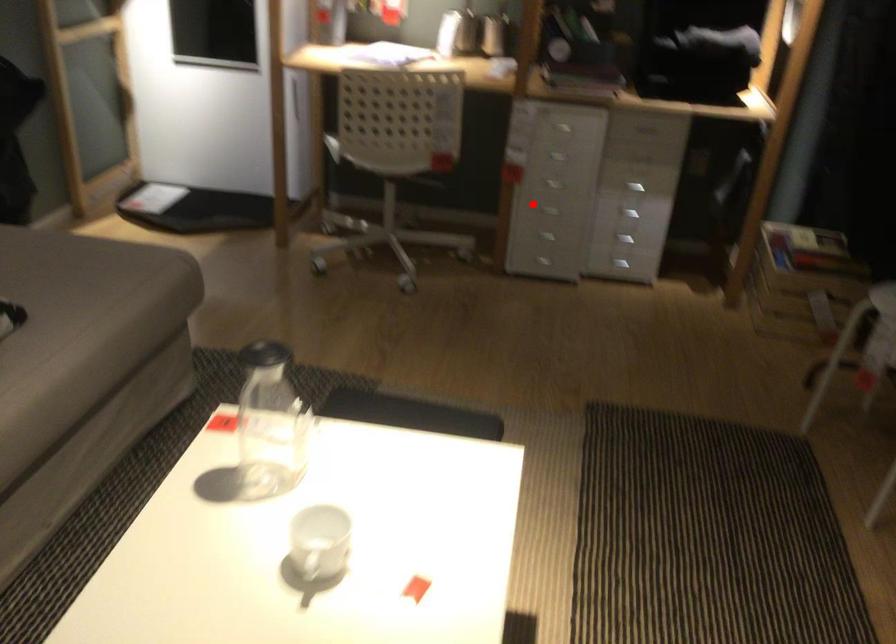
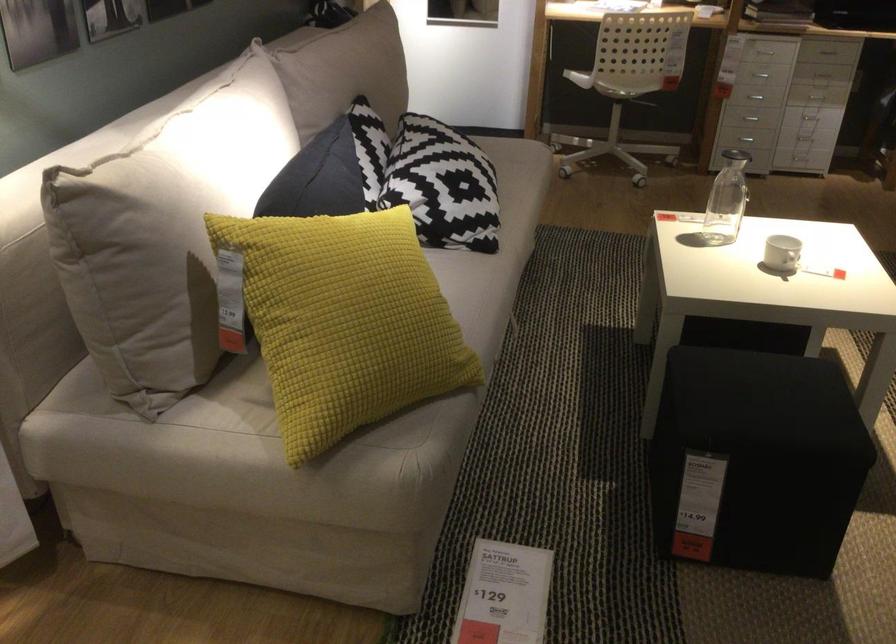
Question: I am providing you with two images of the same scene from different viewpoints. A red point is shown in image1. For the corresponding object point in image2, is it positioned nearer or farther from the camera?

Choices:
 (A) Nearer
 (B) Farther

Answer: (B)